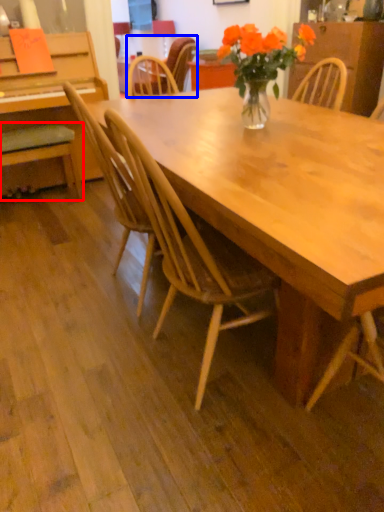
Question: Among these objects, which one is farthest to the camera, chair (highlighted by a red box) or chair (highlighted by a blue box)?

Choices:
 (A) chair
 (B) chair

Answer: (B)